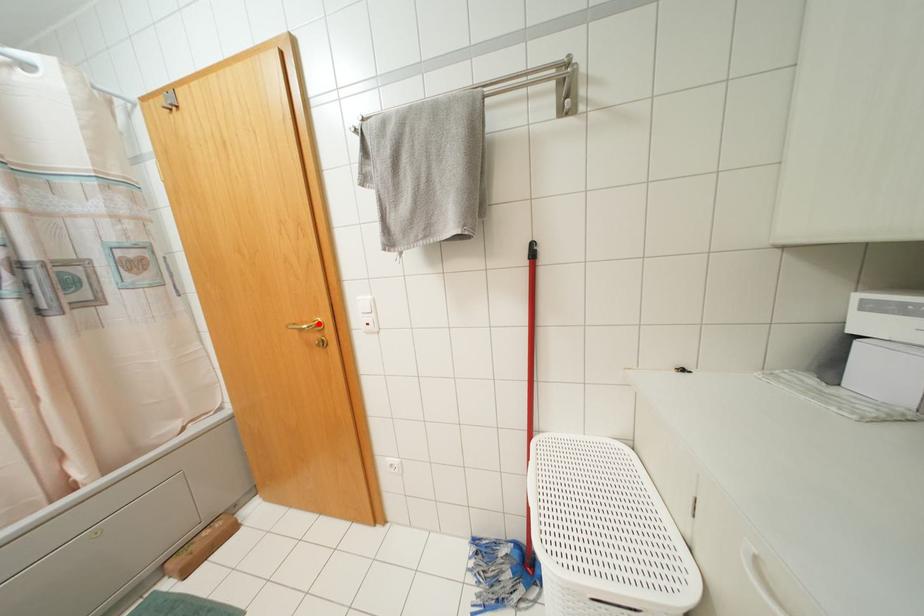
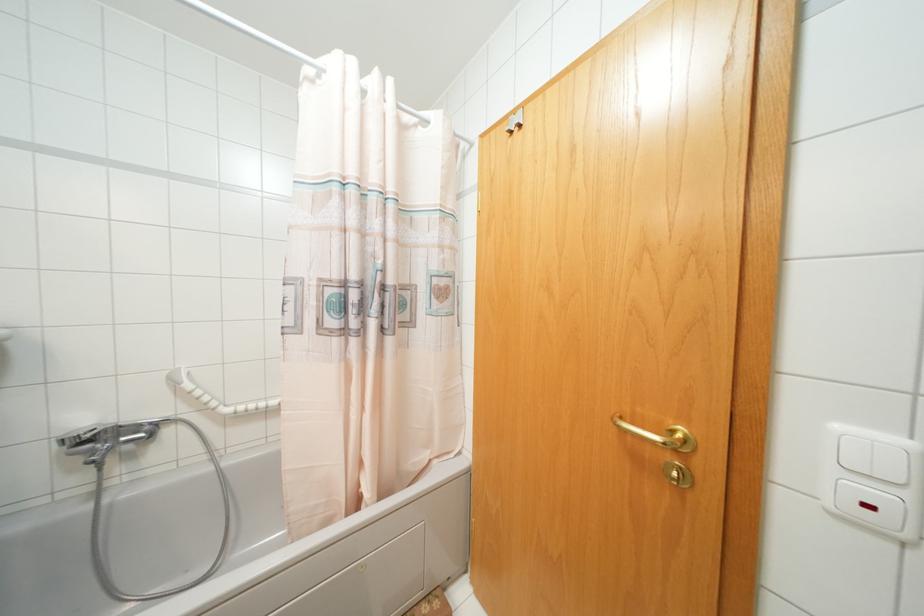
In the second image, find the point that corresponds to the highlighted location in the first image.

(686, 440)